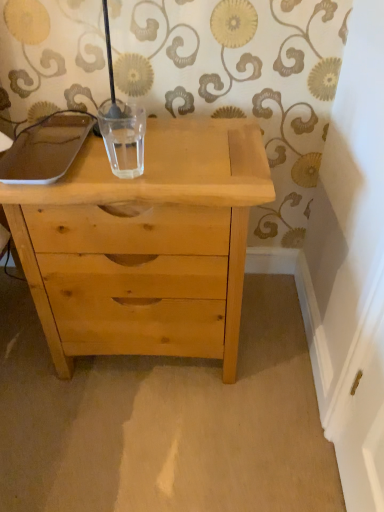
The height and width of the screenshot is (512, 384). Describe the element at coordinates (123, 137) in the screenshot. I see `transparent glass at center` at that location.

In order to click on transparent glass at center in this screenshot , I will do `click(123, 137)`.

The image size is (384, 512). I want to click on natural wood chest of drawers at center, so click(145, 244).

What do you see at coordinates (145, 244) in the screenshot? This screenshot has height=512, width=384. I see `natural wood chest of drawers at center` at bounding box center [145, 244].

Measure the distance between point (39, 207) and camera.

The distance of point (39, 207) from camera is 33.70 inches.

Identify the location of transparent glass at center. The image size is (384, 512). pos(123,137).

Is natural wood chest of drawers at center to the left or to the right of transparent glass at center in the image?

Based on their positions, natural wood chest of drawers at center is located to the right of transparent glass at center.

In the scene shown: Considering the positions of objects natural wood chest of drawers at center and transparent glass at center in the image provided, who is behind, natural wood chest of drawers at center or transparent glass at center?

transparent glass at center is more distant.

Which point is more forward, (254, 182) or (124, 155)?

Point (254, 182)

From the image's perspective, between natural wood chest of drawers at center and transparent glass at center, who is located below?

natural wood chest of drawers at center appears lower in the image.

From a real-world perspective, which object stands above the other?

transparent glass at center, from a real-world perspective.

Considering the relative sizes of natural wood chest of drawers at center and transparent glass at center in the image provided, is natural wood chest of drawers at center wider than transparent glass at center?

Yes, natural wood chest of drawers at center is wider than transparent glass at center.

Who is taller, natural wood chest of drawers at center or transparent glass at center?

natural wood chest of drawers at center is taller.

Does natural wood chest of drawers at center have a smaller size compared to transparent glass at center?

No.

Is transparent glass at center surrounded by natural wood chest of drawers at center?

Definitely not — transparent glass at center is not inside natural wood chest of drawers at center.

Does natural wood chest of drawers at center touch transparent glass at center?

No, natural wood chest of drawers at center is not with transparent glass at center.

Is natural wood chest of drawers at center looking in the opposite direction of transparent glass at center?

No, natural wood chest of drawers at center's orientation is not away from transparent glass at center.

Image resolution: width=384 pixels, height=512 pixels. What are the coordinates of `chest of drawers located on the right of transparent glass at center` in the screenshot? It's located at (145, 244).

Which object is positioned more to the left, transparent glass at center or natural wood chest of drawers at center?

Positioned to the left is transparent glass at center.

In the image, is transparent glass at center positioned in front of or behind natural wood chest of drawers at center?

transparent glass at center is behind natural wood chest of drawers at center.

Does point (115, 173) appear closer or farther from the camera than point (142, 304)?

Clearly, point (115, 173) is closer to the camera than point (142, 304).

Based on the photo, from the image's perspective, is transparent glass at center below natural wood chest of drawers at center?

No.

From a real-world perspective, is transparent glass at center above or below natural wood chest of drawers at center?

From a real-world perspective, transparent glass at center is physically above natural wood chest of drawers at center.

Can you confirm if transparent glass at center is thinner than natural wood chest of drawers at center?

Indeed, transparent glass at center has a lesser width compared to natural wood chest of drawers at center.

Between transparent glass at center and natural wood chest of drawers at center, which one has less height?

transparent glass at center.

Consider the image. Does transparent glass at center have a smaller size compared to natural wood chest of drawers at center?

Yes.

Is transparent glass at center outside of natural wood chest of drawers at center?

Yes, transparent glass at center is not within natural wood chest of drawers at center.

Are transparent glass at center and natural wood chest of drawers at center making contact?

No, transparent glass at center is not beside natural wood chest of drawers at center.

Is transparent glass at center turned away from natural wood chest of drawers at center?

No, transparent glass at center is not facing the opposite direction of natural wood chest of drawers at center.

The image size is (384, 512). What are the coordinates of `the chest of drawers that appears below the transparent glass at center (from the image's perspective)` in the screenshot? It's located at (145, 244).

Where is `chest of drawers on the right of transparent glass at center`? Image resolution: width=384 pixels, height=512 pixels. chest of drawers on the right of transparent glass at center is located at coordinates (145, 244).

This screenshot has width=384, height=512. Identify the location of glass vase that is above the natural wood chest of drawers at center (from the image's perspective). (123, 137).